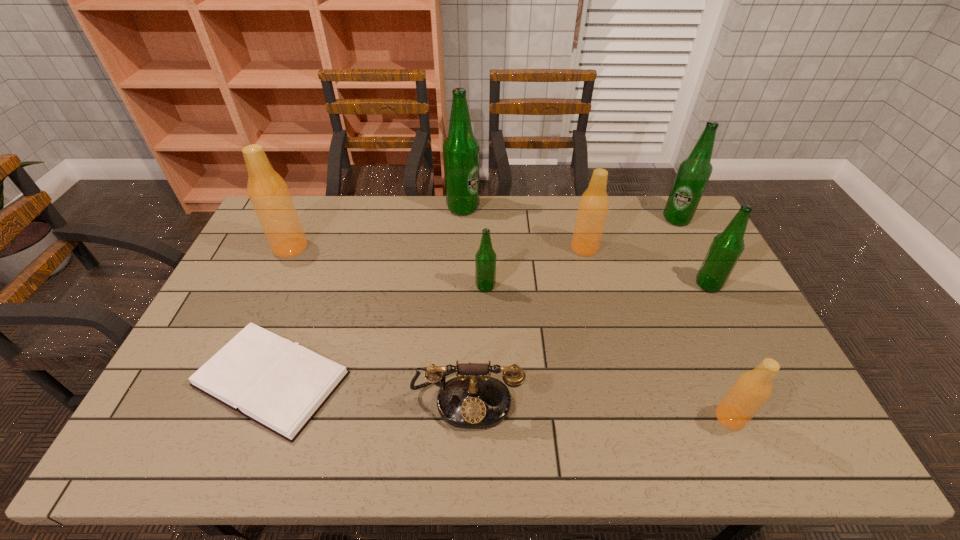
Where is `vacant area at the far right corner of the desktop`? The height and width of the screenshot is (540, 960). vacant area at the far right corner of the desktop is located at coordinates (652, 218).

Image resolution: width=960 pixels, height=540 pixels. In order to click on unoccupied area between the smallest tan beer bottle and the tallest object in this screenshot , I will do `click(596, 313)`.

Find the location of a particular element. unoccupied position between the hardback book and the smallest green beer bottle is located at coordinates (378, 333).

Where is `unoccupied position between the second biggest green beer bottle and the nearest beer bottle`? The width and height of the screenshot is (960, 540). unoccupied position between the second biggest green beer bottle and the nearest beer bottle is located at coordinates (704, 318).

Locate an element on the screen. The width and height of the screenshot is (960, 540). blank region between the fourth beer bottle from right to left and the third biggest green beer bottle is located at coordinates (646, 266).

Identify the location of free point between the second biggest green beer bottle and the fourth beer bottle from left to right. (631, 234).

Identify the location of free point between the telephone and the fourth beer bottle from right to left. (526, 322).

Identify the location of free space between the tallest object and the biggest tan beer bottle. (376, 228).

Find the location of a particular element. This screenshot has width=960, height=540. unoccupied area between the tallest beer bottle and the biggest tan beer bottle is located at coordinates coord(376,228).

Identify the location of vacant area that lies between the rightmost tan beer bottle and the leftmost beer bottle. The width and height of the screenshot is (960, 540). (510, 333).